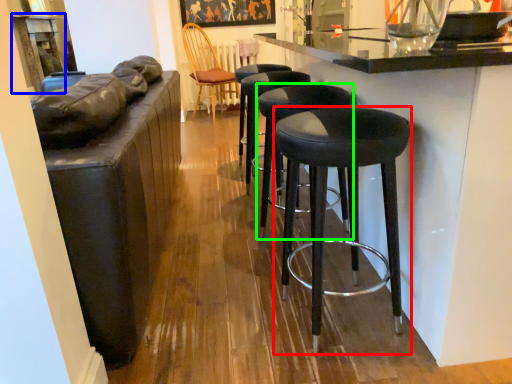
Question: Which object is the closest to the stool (highlighted by a red box)? Choose among these: table (highlighted by a blue box) or stool (highlighted by a green box).

Choices:
 (A) table
 (B) stool

Answer: (B)